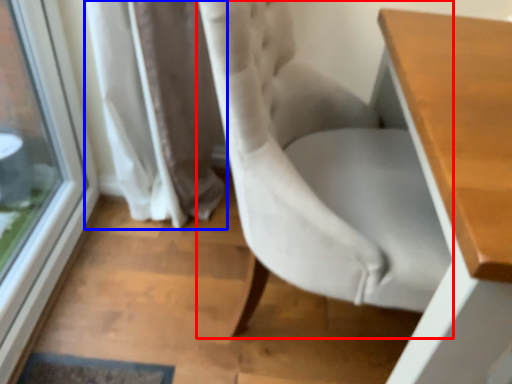
Question: Which object appears farthest to the camera in this image, chair (highlighted by a red box) or curtain (highlighted by a blue box)?

Choices:
 (A) chair
 (B) curtain

Answer: (B)